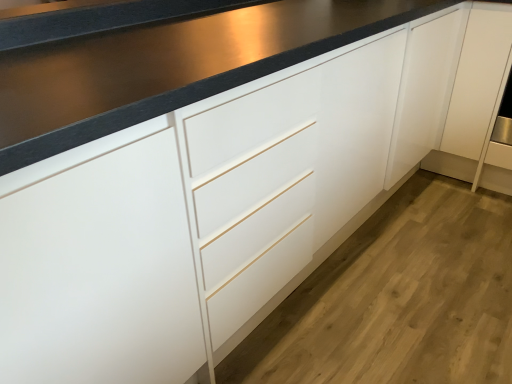
What do you see at coordinates (424, 90) in the screenshot? I see `white matte cabinet at right` at bounding box center [424, 90].

Identify the location of white matte cabinet at right. (424, 90).

The width and height of the screenshot is (512, 384). In order to click on white matte cabinet at right in this screenshot , I will do `click(424, 90)`.